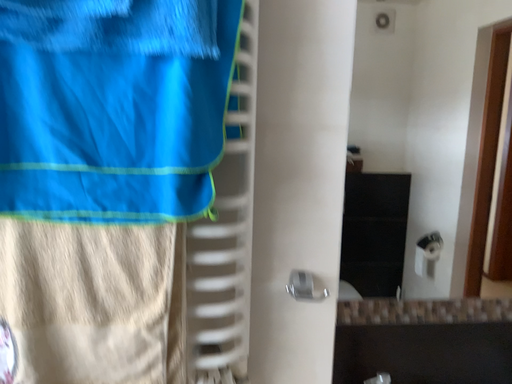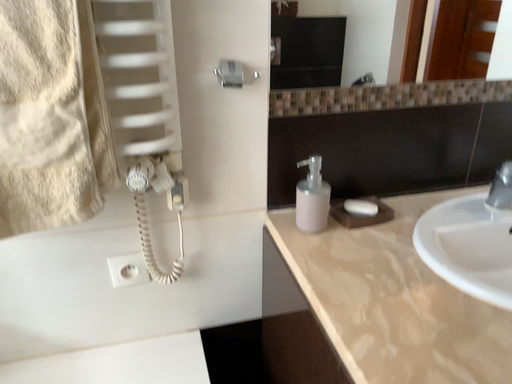
Question: How did the camera likely rotate when shooting the video?

Choices:
 (A) rotated downward
 (B) rotated upward

Answer: (A)